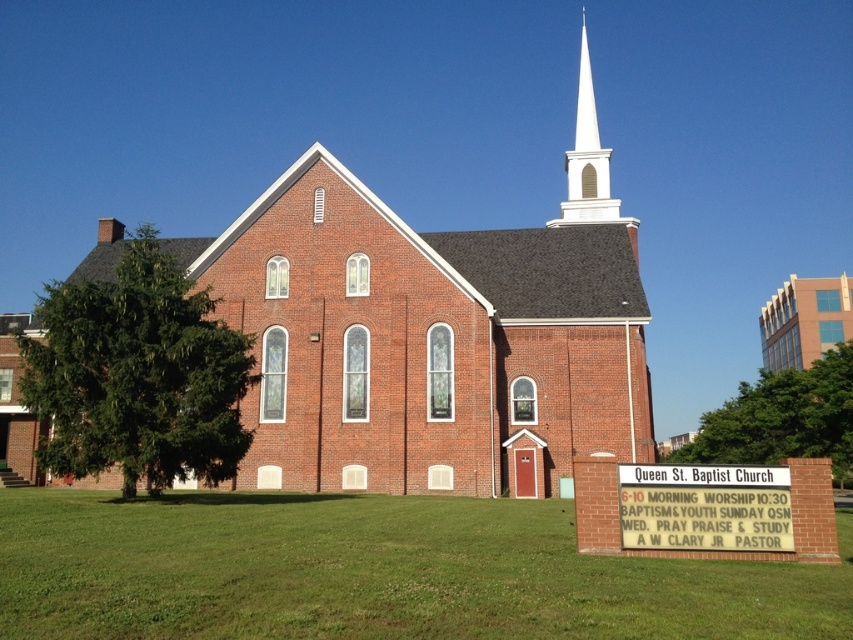
Question: Is brick church steeple at center closer to camera compared to brick building at upper right?

Choices:
 (A) yes
 (B) no

Answer: (A)

Question: Among these points, which one is nearest to the camera?

Choices:
 (A) (844, 275)
 (B) (624, 518)
 (C) (631, 227)

Answer: (B)

Question: Considering the relative positions of brick church steeple at center and white smooth steeple at upper center in the image provided, where is brick church steeple at center located with respect to white smooth steeple at upper center?

Choices:
 (A) above
 (B) below

Answer: (B)

Question: Does brick church steeple at center have a lesser width compared to white plastic sign at center?

Choices:
 (A) no
 (B) yes

Answer: (A)

Question: Which of these objects is positioned farthest from the brick church steeple at center?

Choices:
 (A) brick building at upper right
 (B) white plastic sign at center

Answer: (A)

Question: Based on their relative distances, which object is farther from the brick building at upper right?

Choices:
 (A) white plastic sign at center
 (B) white smooth steeple at upper center

Answer: (A)